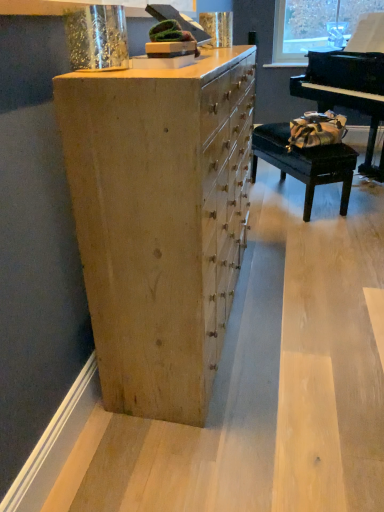
In order to click on unoccupied area in front of black leather table at right in this screenshot , I will do `click(304, 231)`.